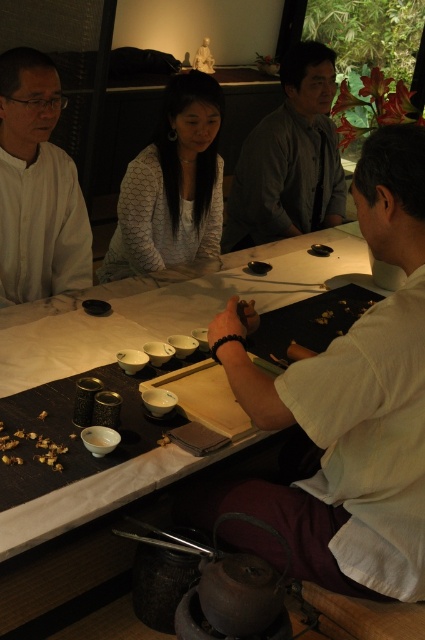
Where is the white textured sweater at center located in the tea ceremony scene?

The white textured sweater at center is located at point coordinates of 0.291 on the x axis and 0.405 on the y axis.

From the picture: You are a photographer standing at the center of the tea ceremony scene. You want to take a photo that includes both the point at coordinates point (351, 394) and point (39, 64). Since you can only focus on one point clearly, which point should you focus on to ensure the other point remains in the background?

You should focus on point (351, 394) because it is closer to the viewer, making point (39, 64) naturally appear in the background.

You are a photographer taking a picture of the tea ceremony scene. You need to ensure that both the white matte shirt at left and the brown crumbly food at lower left are visible in the frame. Based on their positions, which object is taller and might require adjusting the camera angle to capture both?

The white matte shirt at left is taller than the brown crumbly food at lower left, so you might need to angle the camera slightly downward to ensure both are in frame.